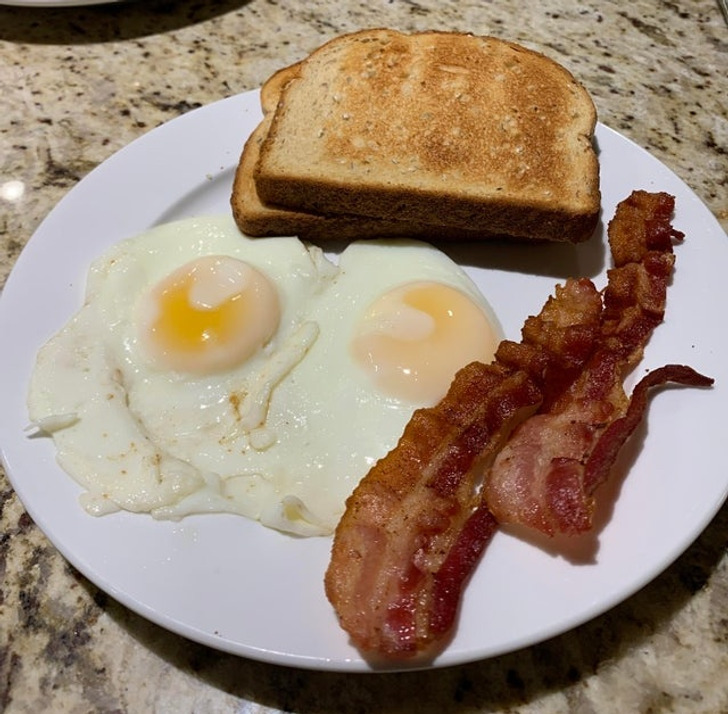
Locate an element on the screen. plate is located at coordinates (280, 600).